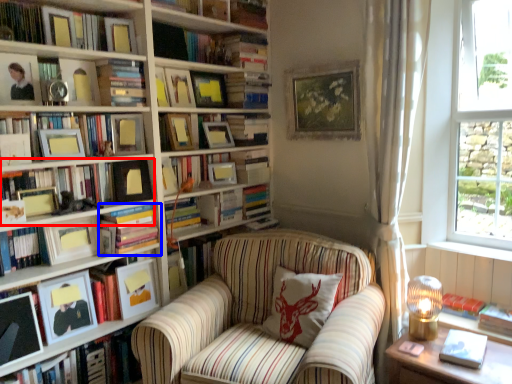
Question: Among these objects, which one is farthest to the camera, book (highlighted by a red box) or book (highlighted by a blue box)?

Choices:
 (A) book
 (B) book

Answer: (B)